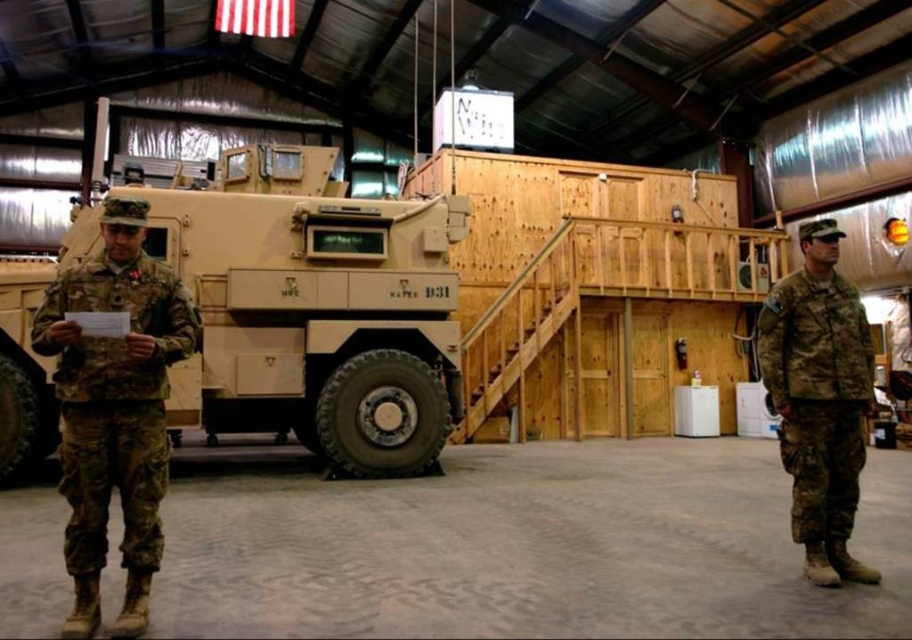
You are a photographer planning to take a group photo of the two individuals in camouflage fabric uniform at left and camouflage fabric uniform at right. Since you want to ensure that both uniforms are clearly visible in the photo, which individual should you position closer to the camera to avoid any part of their uniform being cut off?

The camouflage fabric uniform at left has a greater width than the camouflage fabric uniform at right. To ensure both uniforms are fully visible, position the wider camouflage fabric uniform at left closer to the camera so that its larger size can be accommodated within the frame without being cut off.

You are a military inspector checking the positioning of the uniforms in the hangar. According to the safety protocol, uniforms must not overlap. Are the camouflage fabric uniform at left and camouflage fabric uniform at right arranged correctly?

The camouflage fabric uniform at left is positioned over the camouflage fabric uniform at right, which means they are overlapping. This violates the safety protocol, so the arrangement is incorrect.

You are a photographer positioned at the entrance of the hangar. You need to capture a photo where both the camouflage fabric uniform at left and the camouflage fabric uniform at right are visible. Based on their positions, which uniform should you ensure is placed closer to the left side of the frame?

The camouflage fabric uniform at left should be placed closer to the left side of the frame since it is already positioned to the left of the camouflage fabric uniform at right.